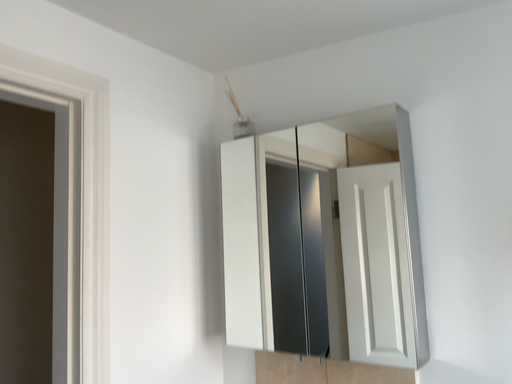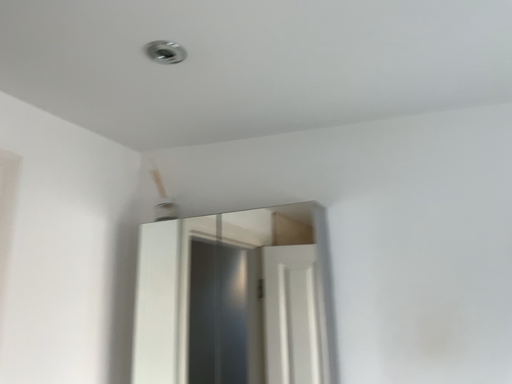
Question: Which way did the camera rotate in the video?

Choices:
 (A) rotated downward
 (B) rotated upward

Answer: (B)